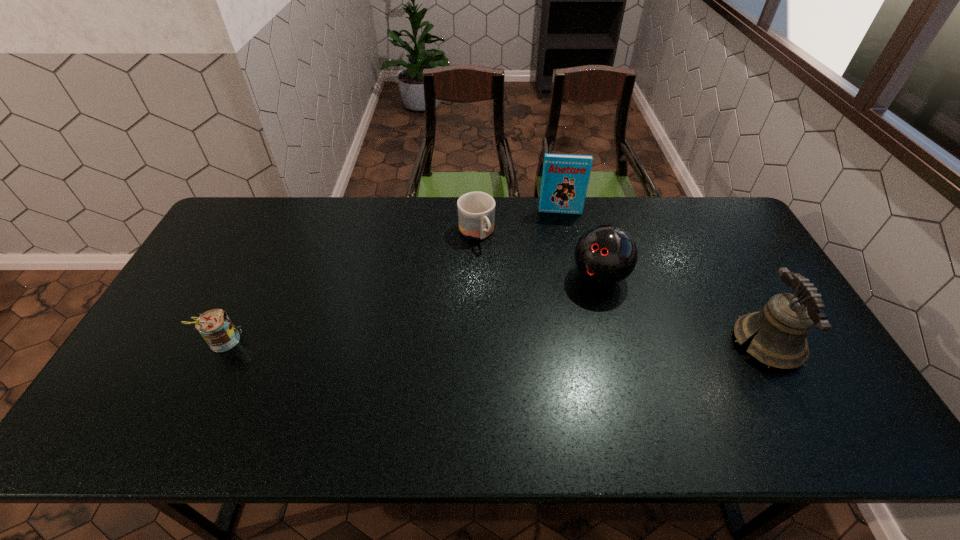
What are the coordinates of `vacant spot on the desktop that is between the leftmost object and the bell and is positioned on the side with the handle of the second farthest object` in the screenshot? It's located at (551, 343).

Find the location of a particular element. vacant space on the desktop that is between the leftmost object and the bell and is positioned on the front cover of the farthest object is located at coordinates (568, 343).

The height and width of the screenshot is (540, 960). Identify the location of free space on the desktop that is between the can and the bell and is positioned on the surface of the bowling ball near the finger holes. (541, 343).